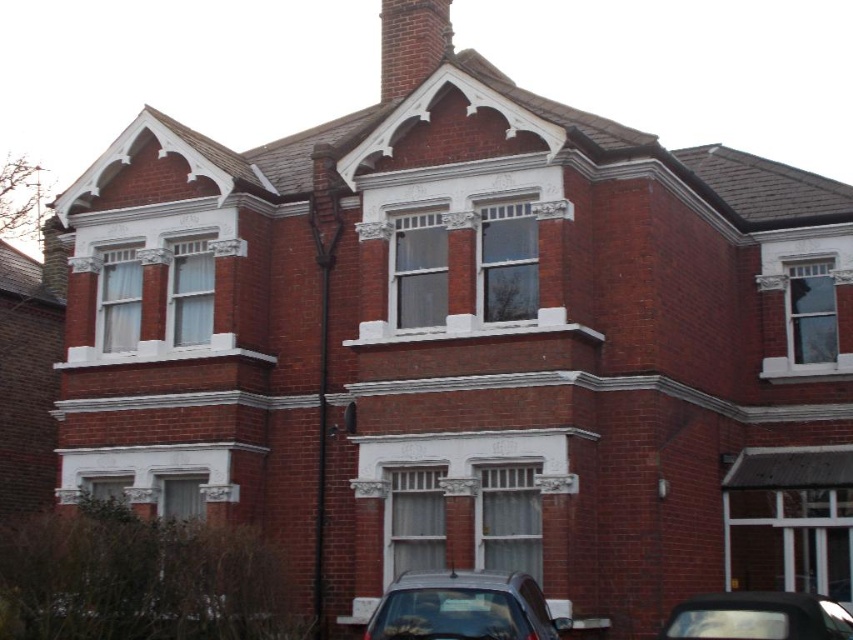
Question: Which object is the farthest from the shiny silver car at lower center?

Choices:
 (A) shiny black car at lower right
 (B) brick chimney at upper center

Answer: (B)

Question: Among these points, which one is farthest from the camera?

Choices:
 (A) (503, 612)
 (B) (820, 620)
 (C) (413, 77)

Answer: (C)

Question: Can you confirm if shiny silver car at lower center is wider than brick chimney at upper center?

Choices:
 (A) no
 (B) yes

Answer: (A)

Question: Does shiny silver car at lower center appear over shiny black car at lower right?

Choices:
 (A) no
 (B) yes

Answer: (B)

Question: Based on their relative distances, which object is nearer to the shiny silver car at lower center?

Choices:
 (A) brick chimney at upper center
 (B) shiny black car at lower right

Answer: (B)

Question: Can you confirm if shiny black car at lower right is wider than brick chimney at upper center?

Choices:
 (A) yes
 (B) no

Answer: (B)